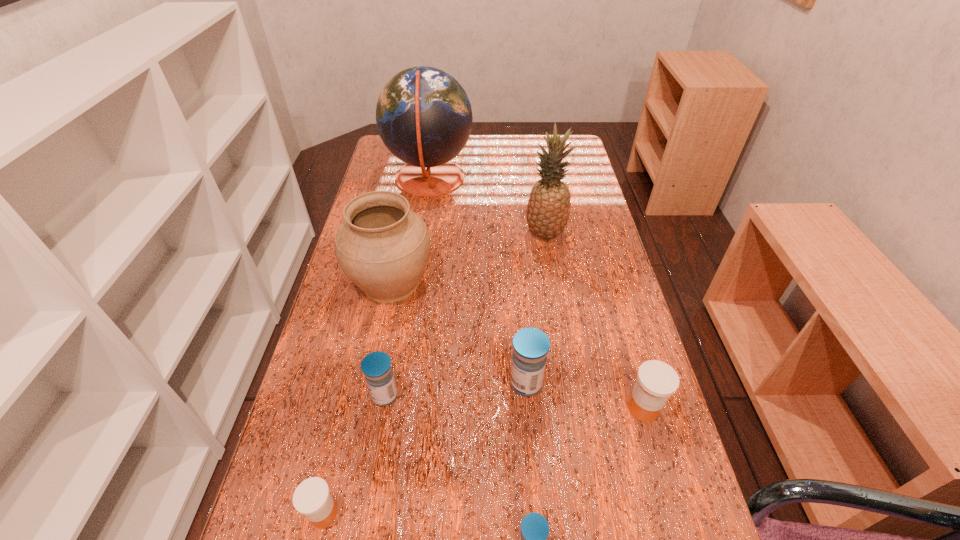
Locate an element on the screen. The image size is (960, 540). vacant space that satisfies the following two spatial constraints: 1. on the back side of the tallest medicine; 2. on the left side of the second farthest object is located at coordinates (514, 234).

Identify the location of vacant space that satisfies the following two spatial constraints: 1. with the Americas facing the viewer on the tallest medicine; 2. on the right side of the globe. [399, 383].

Locate an element on the screen. blank area in the image that satisfies the following two spatial constraints: 1. with the Americas facing the viewer on the globe; 2. on the label of the leftmost medicine is located at coordinates (380, 514).

Find the location of a particular element. free location that satisfies the following two spatial constraints: 1. with the Americas facing the viewer on the farthest object; 2. on the back side of the fourth tallest object is located at coordinates (399, 383).